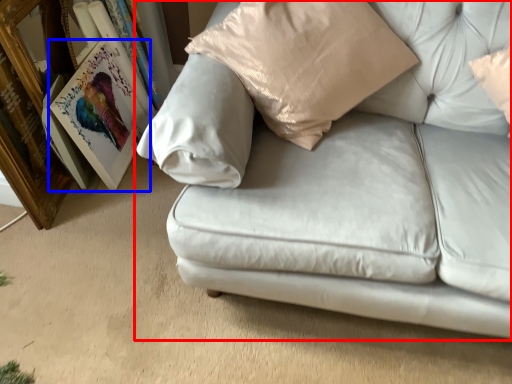
Question: Which object is further to the camera taking this photo, studio couch (highlighted by a red box) or picture frame (highlighted by a blue box)?

Choices:
 (A) studio couch
 (B) picture frame

Answer: (B)